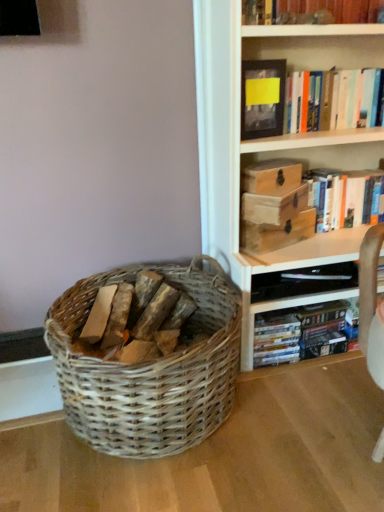
Question: Is hardcover book at upper right, which is the 1th book from bottom to top, taller than wooden chest at upper right, which is counted as the 3th storage box, starting from the top?

Choices:
 (A) no
 (B) yes

Answer: (B)

Question: Is wooden chest at upper right, which is counted as the 3th storage box, starting from the top, completely or partially inside hardcover book at upper right, which is the 1th book from bottom to top?

Choices:
 (A) no
 (B) yes

Answer: (A)

Question: From a real-world perspective, is hardcover book at upper right, which is the 3th book from top to bottom, on top of wooden chest at upper right, positioned as the 1th storage box in bottom-to-top order?

Choices:
 (A) no
 (B) yes

Answer: (B)

Question: Does hardcover book at upper right, which is the 3th book from top to bottom, have a larger size compared to wooden chest at upper right, positioned as the 1th storage box in bottom-to-top order?

Choices:
 (A) no
 (B) yes

Answer: (B)

Question: From the image's perspective, would you say hardcover book at upper right, which is the 3th book from top to bottom, is shown under wooden chest at upper right, positioned as the 1th storage box in bottom-to-top order?

Choices:
 (A) yes
 (B) no

Answer: (B)

Question: Does hardcover book at upper right, which is the 1th book from bottom to top, lie behind wooden chest at upper right, which is counted as the 3th storage box, starting from the top?

Choices:
 (A) yes
 (B) no

Answer: (A)

Question: From the image's perspective, is wooden box at upper center, which is counted as the 2th storage box, starting from the bottom, on top of yellow paper at upper center?

Choices:
 (A) no
 (B) yes

Answer: (A)

Question: Is wooden box at upper center, which is counted as the 2th storage box, starting from the bottom, placed right next to yellow paper at upper center?

Choices:
 (A) yes
 (B) no

Answer: (B)

Question: Can you confirm if wooden box at upper center, which is the 2th storage box from top to bottom, is wider than yellow paper at upper center?

Choices:
 (A) yes
 (B) no

Answer: (A)

Question: Would you say wooden box at upper center, which is counted as the 2th storage box, starting from the bottom, is outside yellow paper at upper center?

Choices:
 (A) yes
 (B) no

Answer: (A)

Question: Is wooden box at upper center, which is counted as the 2th storage box, starting from the bottom, taller than yellow paper at upper center?

Choices:
 (A) yes
 (B) no

Answer: (B)

Question: Is wooden box at upper center, which is counted as the 2th storage box, starting from the bottom, smaller than yellow paper at upper center?

Choices:
 (A) yes
 (B) no

Answer: (B)

Question: Can you confirm if wooden chest at upper right, positioned as the 1th storage box in bottom-to-top order, is bigger than matte black shelf at lower right?

Choices:
 (A) no
 (B) yes

Answer: (A)